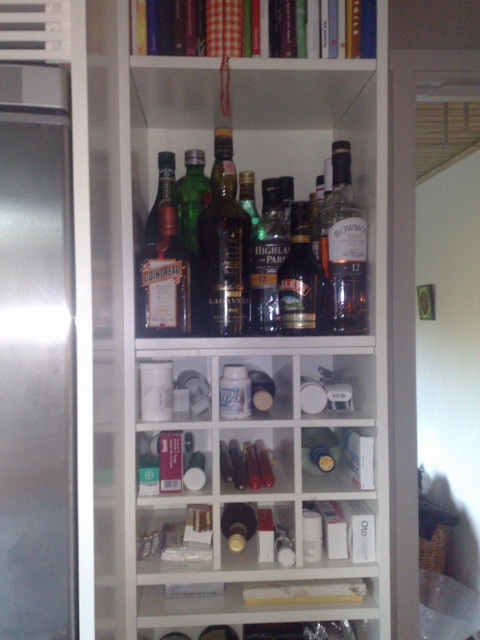
Looking at this image, you are organizing the pantry and need to access the matte glass bottle at upper right. Is it possible to reach it without moving the shiny dark green bottle at center?

The matte glass bottle at upper right is behind the shiny dark green bottle at center, so you can reach it without moving the shiny dark green bottle at center by accessing it from the back side.

You are a bartender preparing to restock a shelf in the pantry. You have a new bottle that is 17 centimeters wide. Can you place it between the shiny dark green bottle at center and the matte glass bottle at upper right without moving any existing bottles?

The distance between the shiny dark green bottle at center and the matte glass bottle at upper right is 16.74 centimeters. Since the new bottle is 17 centimeters wide, it cannot fit in the space between them.